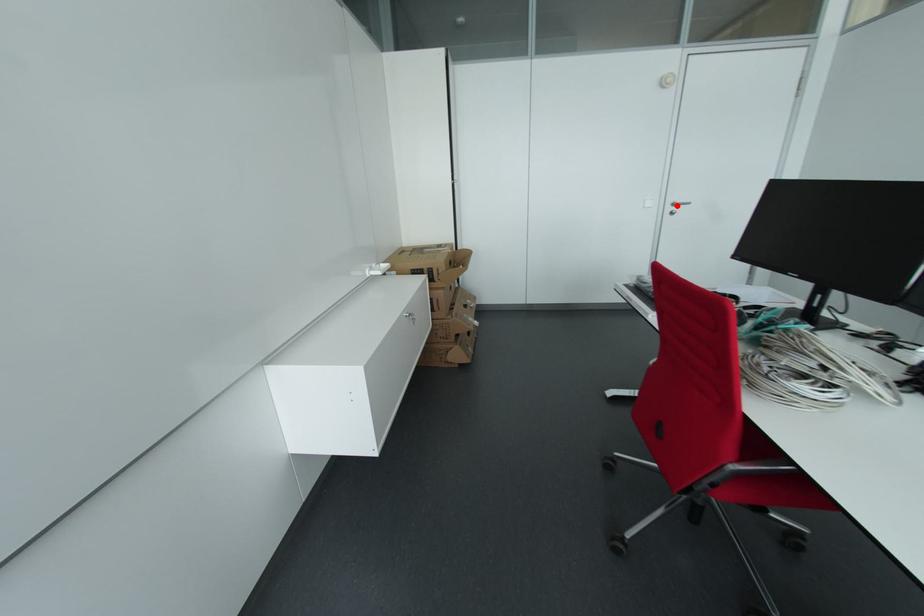
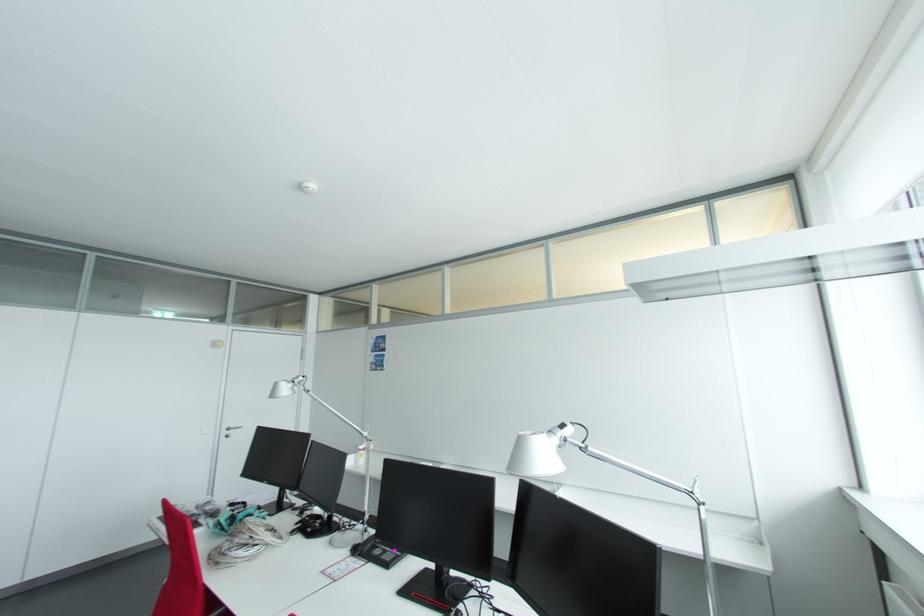
The point at the highlighted location is marked in the first image. Where is the corresponding point in the second image?

(232, 430)